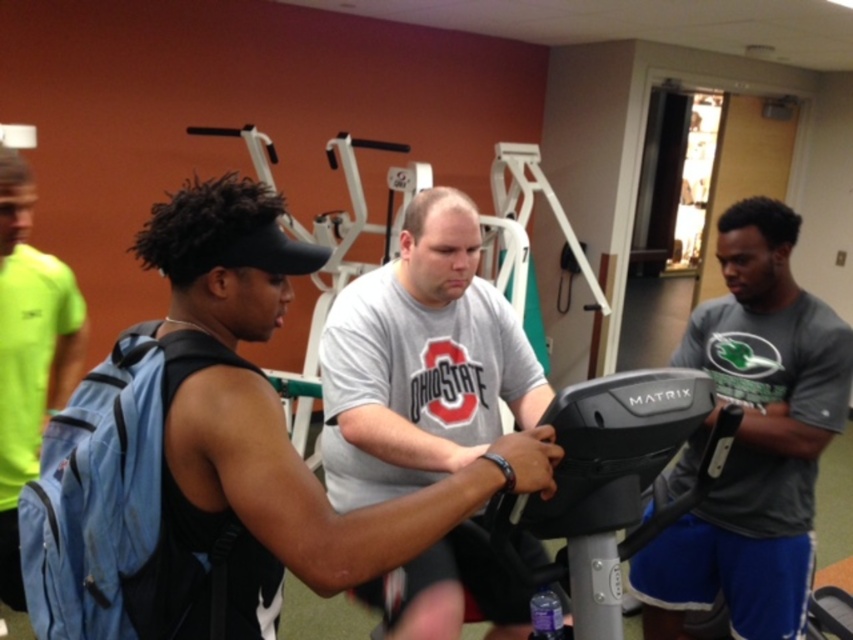
Who is lower down, gray cotton t-shirt at center or black plastic exercise bike at center?

black plastic exercise bike at center

Which is above, gray cotton t-shirt at center or black plastic exercise bike at center?

gray cotton t-shirt at center is above.

This screenshot has height=640, width=853. I want to click on gray cotton t-shirt at center, so click(421, 362).

Is gray matte shirt at center smaller than black plastic exercise bike at center?

Incorrect, gray matte shirt at center is not smaller in size than black plastic exercise bike at center.

Does gray matte shirt at center appear on the right side of black plastic exercise bike at center?

Yes, gray matte shirt at center is to the right of black plastic exercise bike at center.

Image resolution: width=853 pixels, height=640 pixels. Identify the location of gray matte shirt at center. (752, 438).

Who is higher up, black matte tank top at center or gray cotton t-shirt at center?

black matte tank top at center is higher up.

Is black matte tank top at center smaller than gray cotton t-shirt at center?

Yes.

Who is more distant from viewer, (287,492) or (399,444)?

Positioned behind is point (399,444).

Locate an element on the screen. This screenshot has height=640, width=853. black matte tank top at center is located at coordinates (260, 438).